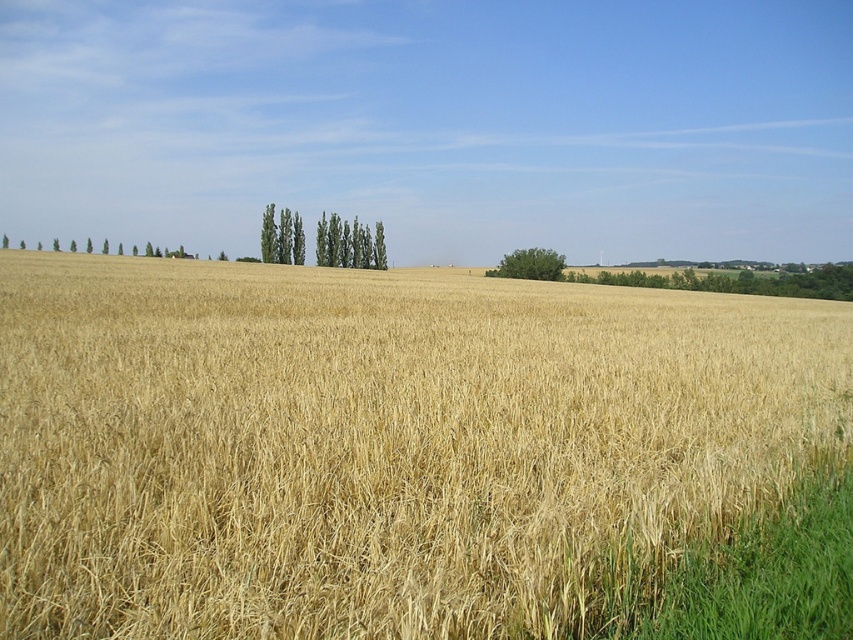
Which of these two, golden dry grass at center or green leafy tree at center, stands shorter?

golden dry grass at center is shorter.

Does point (152, 499) lie in front of point (560, 278)?

Yes.

I want to click on golden dry grass at center, so click(383, 444).

The width and height of the screenshot is (853, 640). Describe the element at coordinates (383, 444) in the screenshot. I see `golden dry grass at center` at that location.

Who is positioned more to the left, golden dry grass at center or green leafy trees at center?

green leafy trees at center

What are the coordinates of `golden dry grass at center` in the screenshot? It's located at (383, 444).

You are a GUI agent. You are given a task and a screenshot of the screen. Output one action in this format:
    pyautogui.click(x=<x>, y=<y>)
    Task: Click on the golden dry grass at center
    The height and width of the screenshot is (640, 853).
    Given the screenshot: What is the action you would take?
    [383, 444]

Which is above, green leafy trees at center or green leafy tree at center?

Positioned higher is green leafy trees at center.

Between green leafy trees at center and green leafy tree at center, which one appears on the right side from the viewer's perspective?

green leafy tree at center is more to the right.

This screenshot has height=640, width=853. In order to click on green leafy trees at center in this screenshot , I will do `click(349, 243)`.

Where is `green leafy trees at center`? green leafy trees at center is located at coordinates (349, 243).